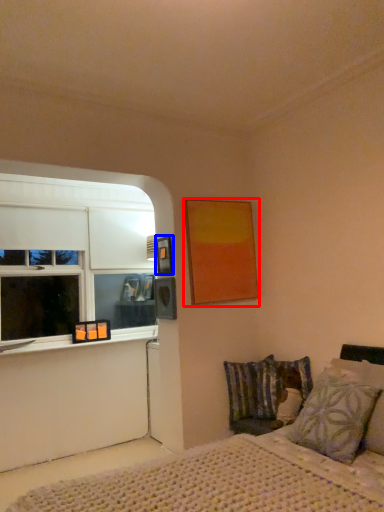
Question: Which of the following is the farthest to the observer, picture frame (highlighted by a red box) or picture frame (highlighted by a blue box)?

Choices:
 (A) picture frame
 (B) picture frame

Answer: (B)